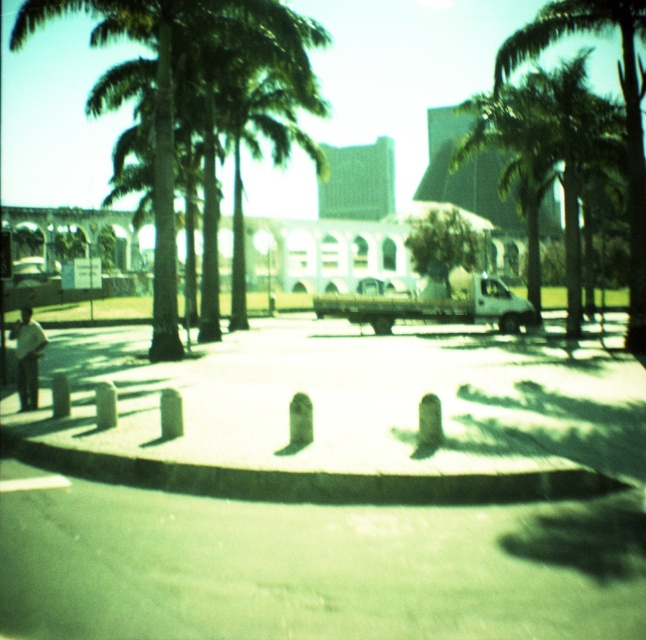
Question: Does white matte truck at center appear under white cotton shirt at left?

Choices:
 (A) no
 (B) yes

Answer: (A)

Question: Among these points, which one is nearest to the camera?

Choices:
 (A) (506, 308)
 (B) (627, 202)
 (C) (154, 141)

Answer: (C)

Question: Among these objects, which one is farthest from the camera?

Choices:
 (A) white matte truck at center
 (B) green leafy tree at center
 (C) green leafy palm tree at center

Answer: (B)

Question: Is green leafy palm tree at center closer to the viewer compared to white cotton shirt at left?

Choices:
 (A) yes
 (B) no

Answer: (B)

Question: Is green leafy tree at center thinner than white cotton shirt at left?

Choices:
 (A) no
 (B) yes

Answer: (B)

Question: Which point appears closest to the camera in this image?

Choices:
 (A) (627, 337)
 (B) (284, 58)
 (C) (461, 307)
 (D) (25, 320)

Answer: (D)